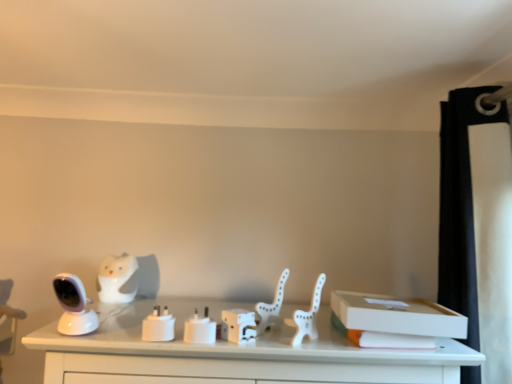
The image size is (512, 384). Describe the element at coordinates (271, 307) in the screenshot. I see `white plastic animal at center, the first animal positioned from the front` at that location.

This screenshot has width=512, height=384. What do you see at coordinates (128, 278) in the screenshot?
I see `white matte owl at left, the 1th animal in the back-to-front sequence` at bounding box center [128, 278].

What do you see at coordinates (238, 326) in the screenshot? I see `white matte plastic box at center, marked as the first box in a left-to-right arrangement` at bounding box center [238, 326].

The height and width of the screenshot is (384, 512). Identify the location of white matte plastic chair at center. (307, 316).

Would you say white matte owl at left, marked as the first animal in a left-to-right arrangement, is inside or outside white matte plug at center?

white matte owl at left, marked as the first animal in a left-to-right arrangement, is spatially situated outside white matte plug at center.

Considering the relative sizes of white matte owl at left, placed as the 2th animal when sorted from right to left, and white matte plug at center in the image provided, is white matte owl at left, placed as the 2th animal when sorted from right to left, thinner than white matte plug at center?

In fact, white matte owl at left, placed as the 2th animal when sorted from right to left, might be wider than white matte plug at center.

From a real-world perspective, is white cardboard box at right, positioned as the 2th box in left-to-right order, positioned under white matte owl at left, placed as the 2th animal when sorted from right to left, based on gravity?

Correct, in the physical world, white cardboard box at right, positioned as the 2th box in left-to-right order, is lower than white matte owl at left, placed as the 2th animal when sorted from right to left.

Is white cardboard box at right, positioned as the 2th box in left-to-right order, situated inside white matte owl at left, which is counted as the second animal, starting from the front, or outside?

white cardboard box at right, positioned as the 2th box in left-to-right order, is not enclosed by white matte owl at left, which is counted as the second animal, starting from the front.

From the image's perspective, is white cardboard box at right, the first box viewed from the right, over white matte owl at left, marked as the first animal in a left-to-right arrangement?

No, from the image's perspective, white cardboard box at right, the first box viewed from the right, is not above white matte owl at left, marked as the first animal in a left-to-right arrangement.

In the image, is white cardboard box at right, the first box viewed from the right, positioned in front of or behind white matte owl at left, the 1th animal in the back-to-front sequence?

white cardboard box at right, the first box viewed from the right, is positioned closer to the viewer than white matte owl at left, the 1th animal in the back-to-front sequence.

Which object is further away from the camera, white plastic animal at center, the 2th animal when ordered from back to front, or white matte plug at center?

white plastic animal at center, the 2th animal when ordered from back to front, is behind.

Considering the relative sizes of white plastic animal at center, the first animal positioned from the front, and white matte plug at center in the image provided, is white plastic animal at center, the first animal positioned from the front, thinner than white matte plug at center?

No.

Is white plastic animal at center, the 2th animal viewed from the left, to the left or to the right of white matte plug at center in the image?

In the image, white plastic animal at center, the 2th animal viewed from the left, appears on the right side of white matte plug at center.

Considering the sizes of white plastic animal at center, the 2th animal when ordered from back to front, and white matte plug at center in the image, is white plastic animal at center, the 2th animal when ordered from back to front, taller or shorter than white matte plug at center?

In the image, white plastic animal at center, the 2th animal when ordered from back to front, appears to be taller than white matte plug at center.

How far apart are white matte plug at center and white cardboard box at right, positioned as the 2th box in left-to-right order?

A distance of 19.08 inches exists between white matte plug at center and white cardboard box at right, positioned as the 2th box in left-to-right order.

Does point (153, 325) lie in front of point (436, 331)?

Yes.

Can you see white matte plug at center touching white cardboard box at right, positioned as the 2th box in left-to-right order?

No, white matte plug at center is not next to white cardboard box at right, positioned as the 2th box in left-to-right order.

Based on the photo, which is more to the right, white matte plug at center or white cardboard box at right, positioned as the 2th box in left-to-right order?

Positioned to the right is white cardboard box at right, positioned as the 2th box in left-to-right order.

How different are the orientations of white matte owl at left, marked as the first animal in a left-to-right arrangement, and white matte plastic box at center, marked as the first box in a left-to-right arrangement, in degrees?

The angle between the facing direction of white matte owl at left, marked as the first animal in a left-to-right arrangement, and the facing direction of white matte plastic box at center, marked as the first box in a left-to-right arrangement, is 3.47 degrees.

Considering the sizes of objects white matte owl at left, marked as the first animal in a left-to-right arrangement, and white matte plastic box at center, marked as the first box in a left-to-right arrangement, in the image provided, who is shorter, white matte owl at left, marked as the first animal in a left-to-right arrangement, or white matte plastic box at center, marked as the first box in a left-to-right arrangement,?

white matte plastic box at center, marked as the first box in a left-to-right arrangement, is shorter.

Which is in front, white matte owl at left, the 1th animal in the back-to-front sequence, or white matte plastic box at center, the second box when ordered from right to left?

white matte plastic box at center, the second box when ordered from right to left, is in front.

From the image's perspective, is white matte owl at left, marked as the first animal in a left-to-right arrangement, located above white matte plastic box at center, marked as the first box in a left-to-right arrangement?

Yes, from the image's perspective, white matte owl at left, marked as the first animal in a left-to-right arrangement, is over white matte plastic box at center, marked as the first box in a left-to-right arrangement.

Is white matte plastic box at center, the second box when ordered from right to left, positioned behind white matte plastic chair at center?

Yes, white matte plastic box at center, the second box when ordered from right to left, is further from the camera.

Can you confirm if white matte plastic box at center, marked as the first box in a left-to-right arrangement, is wider than white matte plastic chair at center?

No, white matte plastic box at center, marked as the first box in a left-to-right arrangement, is not wider than white matte plastic chair at center.

Measure the distance between white matte plastic box at center, marked as the first box in a left-to-right arrangement, and white matte plastic chair at center.

4.67 inches.

Find the location of a particular element. chair in front of the white matte plastic box at center, marked as the first box in a left-to-right arrangement is located at coordinates (307, 316).

Considering the sizes of objects white plastic animal at center, the first animal positioned from the front, and white matte owl at left, placed as the 2th animal when sorted from right to left, in the image provided, who is bigger, white plastic animal at center, the first animal positioned from the front, or white matte owl at left, placed as the 2th animal when sorted from right to left,?

With larger size is white matte owl at left, placed as the 2th animal when sorted from right to left.

The width and height of the screenshot is (512, 384). Find the location of `animal above the white matte owl at left, marked as the first animal in a left-to-right arrangement (from a real-world perspective)`. animal above the white matte owl at left, marked as the first animal in a left-to-right arrangement (from a real-world perspective) is located at coordinates (271, 307).

Considering the positions of objects white plastic animal at center, the 2th animal when ordered from back to front, and white matte owl at left, the 1th animal in the back-to-front sequence, in the image provided, who is in front, white plastic animal at center, the 2th animal when ordered from back to front, or white matte owl at left, the 1th animal in the back-to-front sequence,?

white plastic animal at center, the 2th animal when ordered from back to front, is more forward.

Considering the sizes of objects white plastic animal at center, the 2th animal when ordered from back to front, and white matte owl at left, the 1th animal in the back-to-front sequence, in the image provided, who is taller, white plastic animal at center, the 2th animal when ordered from back to front, or white matte owl at left, the 1th animal in the back-to-front sequence,?

With more height is white matte owl at left, the 1th animal in the back-to-front sequence.

I want to click on the 1st animal above the white matte plug at center (from a real-world perspective), so click(128, 278).

This screenshot has width=512, height=384. Find the location of `the 2nd box in front of the white matte owl at left, marked as the first animal in a left-to-right arrangement, counting from the anchor's position`. the 2nd box in front of the white matte owl at left, marked as the first animal in a left-to-right arrangement, counting from the anchor's position is located at coordinates (397, 315).

When comparing their distances from white matte plug at center, does white cardboard box at right, the first box viewed from the right, or white matte plastic box at center, marked as the first box in a left-to-right arrangement, seem closer?

Based on the image, white matte plastic box at center, marked as the first box in a left-to-right arrangement, appears to be nearer to white matte plug at center.

Considering their positions, is white matte plug at center positioned closer to white cardboard box at right, the first box viewed from the right, than white matte plastic box at center, the second box when ordered from right to left?

The object closer to white cardboard box at right, the first box viewed from the right, is white matte plastic box at center, the second box when ordered from right to left.

In the scene shown: From the image, which object appears to be nearer to white cardboard box at right, positioned as the 2th box in left-to-right order, white matte owl at left, placed as the 2th animal when sorted from right to left, or white plastic animal at center, the 2th animal when ordered from back to front?

Based on the image, white plastic animal at center, the 2th animal when ordered from back to front, appears to be nearer to white cardboard box at right, positioned as the 2th box in left-to-right order.

Estimate the real-world distances between objects in this image. Which object is closer to white plastic animal at center, which is the 1th animal from right to left, white matte plug at center or white cardboard box at right, positioned as the 2th box in left-to-right order?

Among the two, white matte plug at center is located nearer to white plastic animal at center, which is the 1th animal from right to left.

From the image, which object appears to be nearer to white cardboard box at right, positioned as the 2th box in left-to-right order, white matte plug at center or white plastic animal at center, which is the 1th animal from right to left?

white plastic animal at center, which is the 1th animal from right to left.

Looking at the image, which one is located closer to white plastic animal at center, the 2th animal viewed from the left, white matte plastic box at center, the second box when ordered from right to left, or white cardboard box at right, positioned as the 2th box in left-to-right order?

white matte plastic box at center, the second box when ordered from right to left, is closer to white plastic animal at center, the 2th animal viewed from the left.

Looking at the image, which one is located further to white plastic animal at center, the 2th animal viewed from the left, white matte plastic box at center, marked as the first box in a left-to-right arrangement, or white matte plastic chair at center?

Based on the image, white matte plastic box at center, marked as the first box in a left-to-right arrangement, appears to be further to white plastic animal at center, the 2th animal viewed from the left.

From the image, which object appears to be nearer to white cardboard box at right, the first box viewed from the right, white matte plastic box at center, marked as the first box in a left-to-right arrangement, or white matte plastic chair at center?

white matte plastic chair at center lies closer to white cardboard box at right, the first box viewed from the right, than the other object.

This screenshot has height=384, width=512. I want to click on chair between white matte plastic box at center, the second box when ordered from right to left, and white cardboard box at right, the first box viewed from the right, from left to right, so click(307, 316).

The width and height of the screenshot is (512, 384). Find the location of `chair situated between white plastic animal at center, which is the 1th animal from right to left, and white cardboard box at right, the first box viewed from the right, from left to right`. chair situated between white plastic animal at center, which is the 1th animal from right to left, and white cardboard box at right, the first box viewed from the right, from left to right is located at coordinates (307, 316).

Identify the location of box between white matte owl at left, marked as the first animal in a left-to-right arrangement, and white cardboard box at right, positioned as the 2th box in left-to-right order, in the horizontal direction. The width and height of the screenshot is (512, 384). (238, 326).

Find the location of `candle holder located between white matte owl at left, which is counted as the second animal, starting from the front, and white matte plastic chair at center in the left-right direction`. candle holder located between white matte owl at left, which is counted as the second animal, starting from the front, and white matte plastic chair at center in the left-right direction is located at coordinates (158, 326).